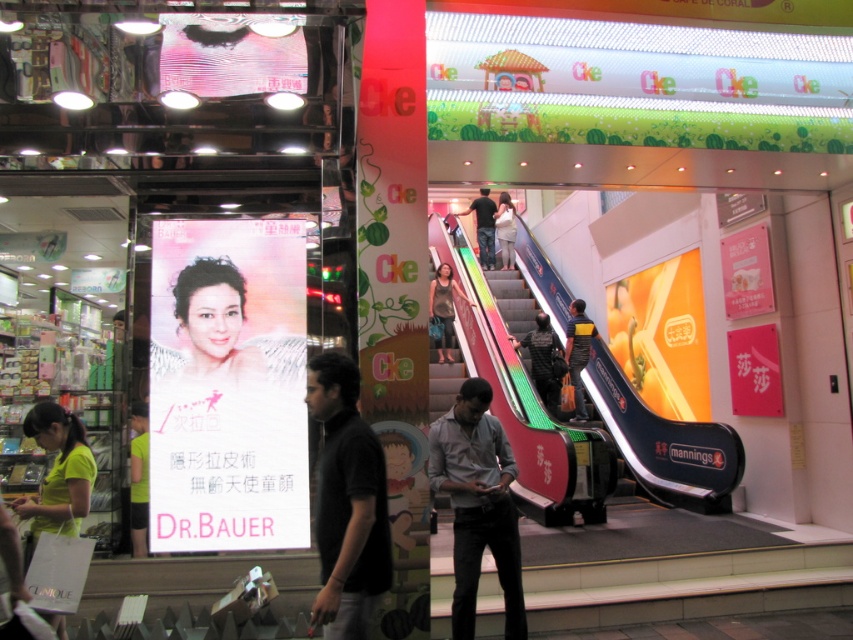
Which is in front, point (386, 500) or point (488, 198)?

Point (386, 500) is in front.

You are a GUI agent. You are given a task and a screenshot of the screen. Output one action in this format:
    pyautogui.click(x=<x>, y=<y>)
    Task: Click on the black matte shirt at center
    
    Given the screenshot: What is the action you would take?
    pyautogui.click(x=347, y=502)

Is point (347, 483) farther from camera compared to point (485, 216)?

No, (347, 483) is closer to viewer.

The image size is (853, 640). In order to click on black matte shirt at center in this screenshot , I will do [347, 502].

Find the location of a particular element. This screenshot has height=640, width=853. orange glossy sign at upper right is located at coordinates (662, 337).

Can you confirm if orange glossy sign at upper right is bigger than white cotton shirt at center?

Yes, orange glossy sign at upper right is bigger than white cotton shirt at center.

Describe the element at coordinates (662, 337) in the screenshot. This screenshot has height=640, width=853. I see `orange glossy sign at upper right` at that location.

Image resolution: width=853 pixels, height=640 pixels. In order to click on orange glossy sign at upper right in this screenshot , I will do `click(662, 337)`.

Locate an element on the screen. The height and width of the screenshot is (640, 853). dark gray fabric jacket at center is located at coordinates (544, 360).

Does dark gray fabric jacket at center have a smaller size compared to light green fabric shirt at lower left?

Incorrect, dark gray fabric jacket at center is not smaller in size than light green fabric shirt at lower left.

This screenshot has height=640, width=853. Describe the element at coordinates (544, 360) in the screenshot. I see `dark gray fabric jacket at center` at that location.

Where is `dark gray fabric jacket at center`? This screenshot has width=853, height=640. dark gray fabric jacket at center is located at coordinates (544, 360).